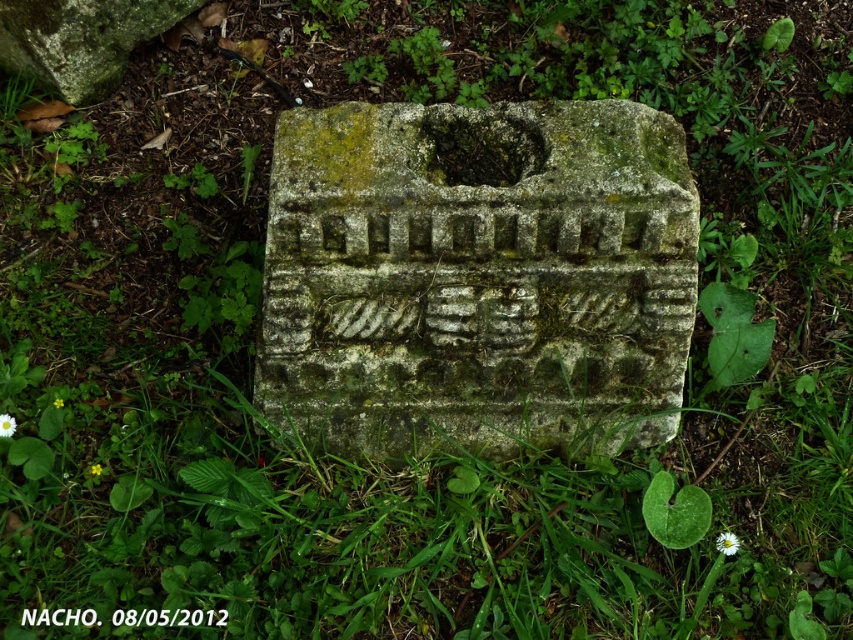
Looking at this image, you are an archaeologist examining the green mossy stone at center and the black paper at center. Which object would you need to handle with more care to avoid damaging its surface?

The green mossy stone at center has a larger size compared to black paper at center, so it might require more careful handling to prevent damage to its delicate mossy surface.

You are standing at the origin point of the coordinate system in the image. You want to find the green mossy stone at center. What are the coordinates where you should look to locate it?

The coordinates of the green mossy stone at center are at point (477, 276).

You are an archaeologist who needs to place a protective covering over the green mossy stone at center and the black paper at center. The covering you have is 30 inches wide. Can you cover both objects with the same covering without moving them?

The distance between the green mossy stone at center and the black paper at center is 30.44 inches. Since the covering is only 30 inches wide, it is not wide enough to cover both objects without moving them.